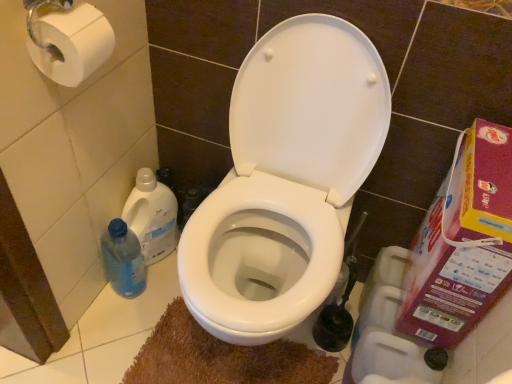
The image size is (512, 384). What are the coordinates of `free space in front of blue translucent bottle at left, which ranks as the first cleaning product in bottom-to-top order` in the screenshot? It's located at (109, 331).